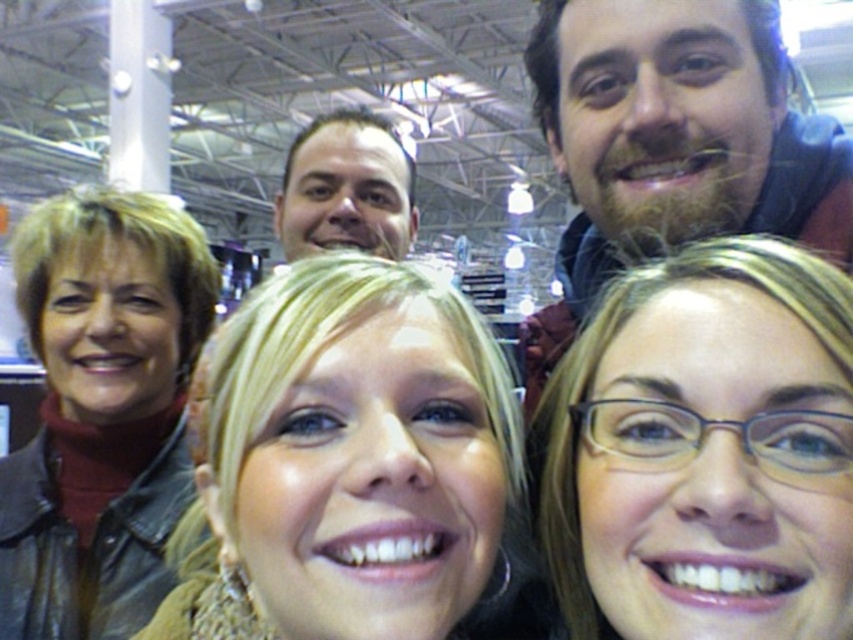
Who is lower down, brown leather jacket at left or smooth brown hair at center?

Positioned lower is brown leather jacket at left.

Where is `brown leather jacket at left`? The width and height of the screenshot is (853, 640). brown leather jacket at left is located at coordinates (102, 410).

Does matte brown hair at lower right have a greater width compared to smooth brown hair at center?

In fact, matte brown hair at lower right might be narrower than smooth brown hair at center.

Can you confirm if matte brown hair at lower right is positioned below smooth brown hair at center?

Yes.

I want to click on matte brown hair at lower right, so click(704, 451).

Between blonde hair at center and brown leather jacket at left, which one appears on the left side from the viewer's perspective?

From the viewer's perspective, brown leather jacket at left appears more on the left side.

In order to click on blonde hair at center in this screenshot , I will do `click(357, 468)`.

Between point (381, 420) and point (16, 486), which one is positioned in front?

Point (381, 420) is in front.

Identify the location of blonde hair at center. (357, 468).